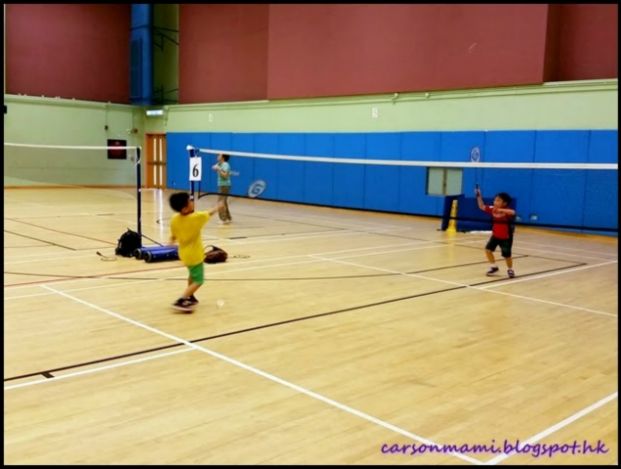
The height and width of the screenshot is (469, 621). What are the coordinates of `shiny light wood floor` in the screenshot? It's located at (474, 379).